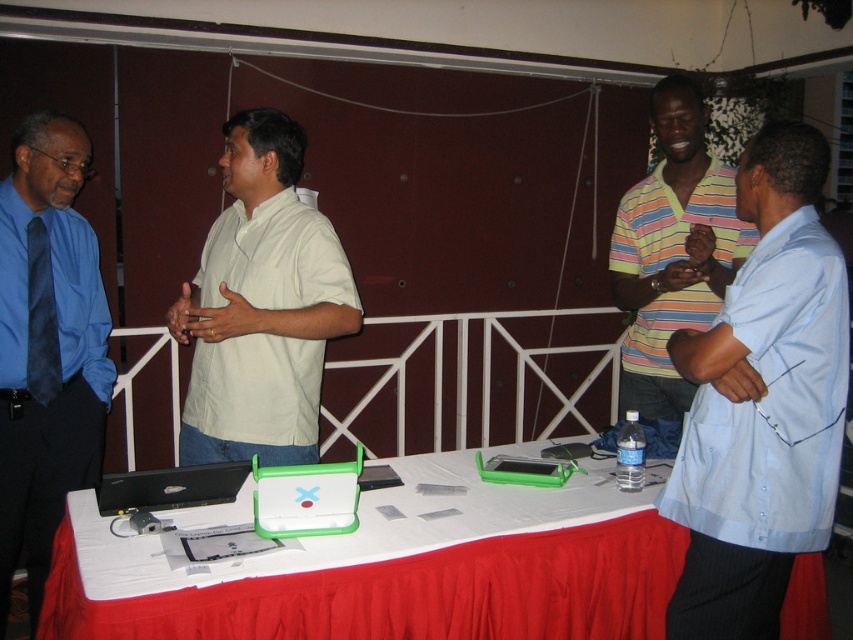
You are a photographer taking a picture of the scene. You need to ensure that both the light beige cotton shirt at center and the black matte laptop at lower left are visible in the frame. Based on their sizes, which object should you focus on first to ensure both are in focus?

The light beige cotton shirt at center is much taller than the black matte laptop at lower left, so focusing on the larger object first will help ensure both are in focus.